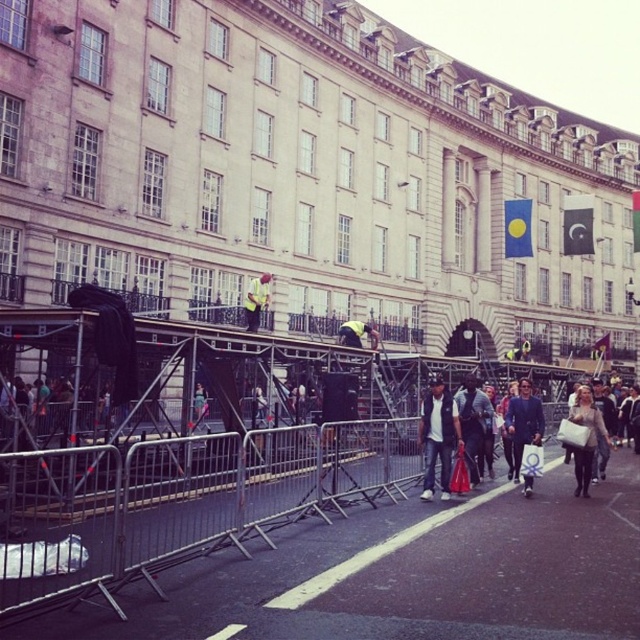
Can you confirm if dark blue suit at center is smaller than yellow fabric at center?

Actually, dark blue suit at center might be larger than yellow fabric at center.

What do you see at coordinates (524, 422) in the screenshot? I see `dark blue suit at center` at bounding box center [524, 422].

You are a GUI agent. You are given a task and a screenshot of the screen. Output one action in this format:
    pyautogui.click(x=<x>, y=<y>)
    Task: Click on the dark blue suit at center
    This screenshot has width=640, height=640.
    Given the screenshot: What is the action you would take?
    pyautogui.click(x=524, y=422)

Which of these two, denim jacket at center or yellow fabric at center, stands taller?

With more height is denim jacket at center.

Is denim jacket at center taller than yellow fabric at center?

Yes, denim jacket at center is taller than yellow fabric at center.

Is point (448, 442) more distant than point (244, 316)?

No, it is not.

You are a GUI agent. You are given a task and a screenshot of the screen. Output one action in this format:
    pyautogui.click(x=<x>, y=<y>)
    Task: Click on the denim jacket at center
    
    Given the screenshot: What is the action you would take?
    pyautogui.click(x=438, y=435)

Which is more to the right, denim jacket at center or dark blue suit at center?

dark blue suit at center

Consider the image. Is denim jacket at center to the right of dark blue suit at center from the viewer's perspective?

No, denim jacket at center is not to the right of dark blue suit at center.

Which is in front, point (435, 410) or point (532, 410)?

Point (435, 410)

The width and height of the screenshot is (640, 640). I want to click on denim jacket at center, so click(x=438, y=435).